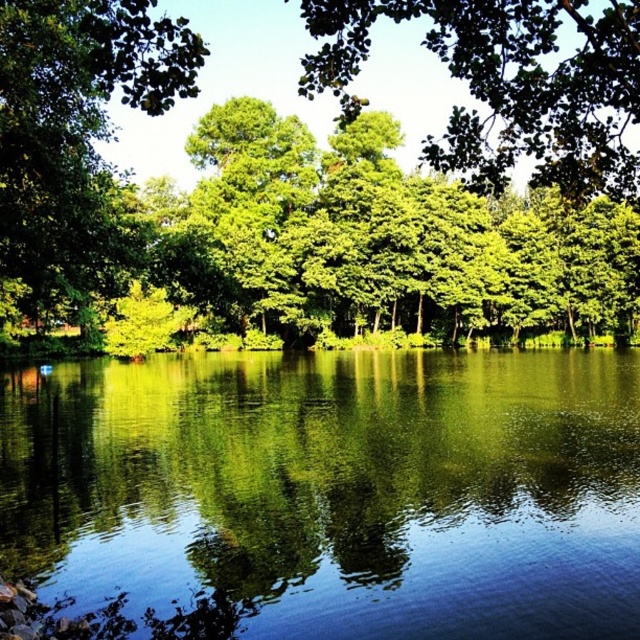
You are standing at the edge of the green reflective water at center and want to walk towards the green leafy tree at left. In which direction should you go?

The green reflective water at center is positioned on the right side of green leafy tree at left, so you should walk to the left to reach the green leafy tree at left.

You are standing at the bottom left corner of the image and want to reach the point labeled as point (605, 401). However, there is an obstacle at point (358, 298). Will you encounter the obstacle before reaching your destination?

Since point (358, 298) is behind point (605, 401) from your perspective, you will not encounter the obstacle before reaching your destination.

You are standing at the bottom left corner of the image. Which direction should you walk to reach the green reflective water at center?

The green reflective water at center is located at point (333, 490), so you should walk towards the upper right direction from the bottom left corner to reach it.